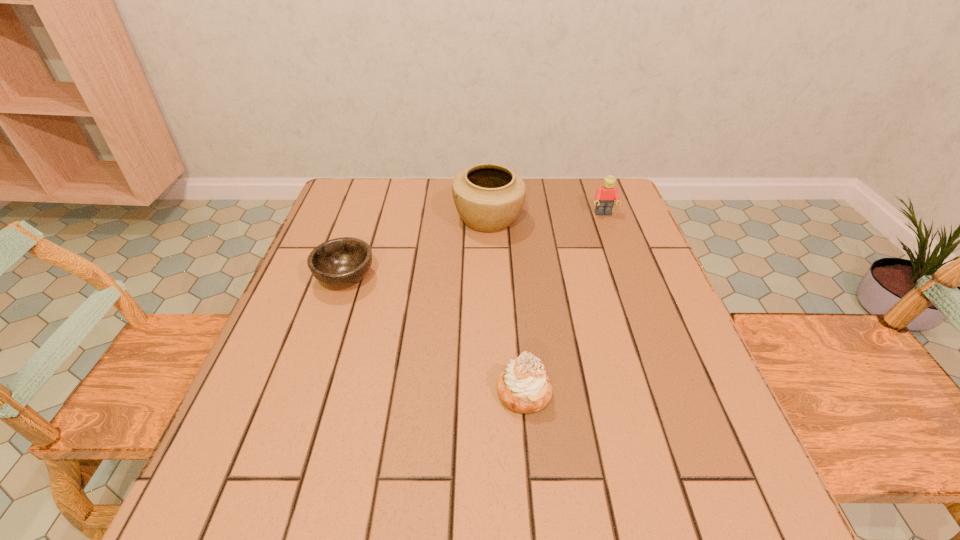
At what (x,y) coordinates should I click in order to perform the action: click on free space at the far left corner of the desktop. Please return your answer as a coordinate pair (x, y). The image size is (960, 540). Looking at the image, I should click on (365, 203).

This screenshot has height=540, width=960. In the image, there is a desktop. Find the location of `vacant space at the near right corner`. vacant space at the near right corner is located at coordinates (740, 495).

Locate an element on the screen. The height and width of the screenshot is (540, 960). free space between the leftmost object and the tallest object is located at coordinates (417, 248).

At what (x,y) coordinates should I click in order to perform the action: click on free space between the third shortest object and the bowl. Please return your answer as a coordinate pair (x, y). Looking at the image, I should click on [474, 246].

Image resolution: width=960 pixels, height=540 pixels. Identify the location of free point between the second shortest object and the tallest object. (506, 306).

You are a GUI agent. You are given a task and a screenshot of the screen. Output one action in this format:
    pyautogui.click(x=<x>, y=<y>)
    Task: Click on the free space that is in between the tallest object and the Lego
    This screenshot has width=960, height=540.
    Given the screenshot: What is the action you would take?
    pyautogui.click(x=546, y=217)

Find the location of `free space between the bowl and the third tallest object`. free space between the bowl and the third tallest object is located at coordinates (435, 335).

This screenshot has height=540, width=960. Find the location of `vacant space that's between the third farthest object and the pastry`. vacant space that's between the third farthest object and the pastry is located at coordinates (435, 335).

Image resolution: width=960 pixels, height=540 pixels. I want to click on blank region between the tallest object and the nearest object, so click(x=506, y=306).

Locate an element on the screen. This screenshot has width=960, height=540. vacant space in between the second shortest object and the pottery is located at coordinates (506, 306).